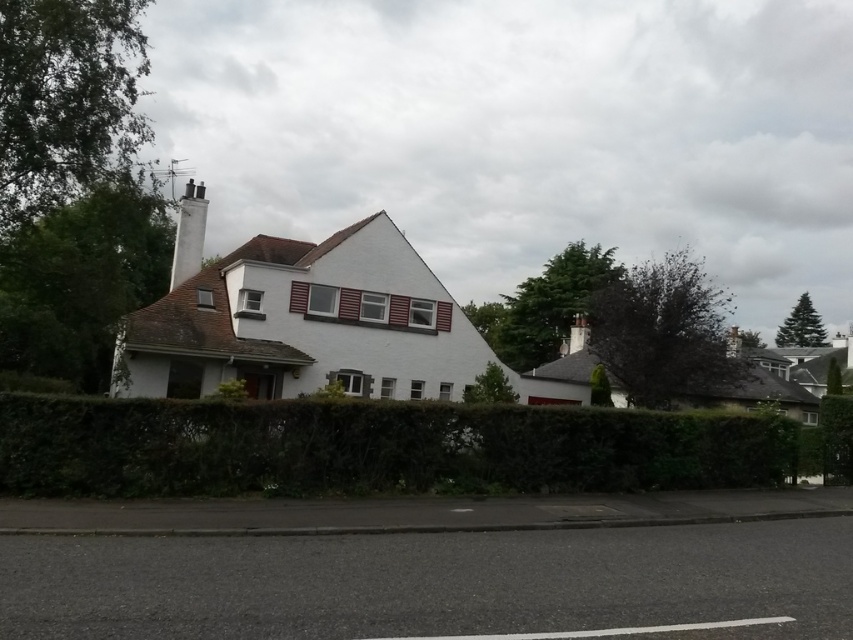
What do you see at coordinates (375, 448) in the screenshot? I see `green leafy hedge at lower center` at bounding box center [375, 448].

Which is above, green leafy hedge at lower center or white smooth chimney at upper center?

white smooth chimney at upper center is higher up.

Does point (376, 404) come behind point (183, 280)?

No, it is not.

Locate an element on the screen. green leafy hedge at lower center is located at coordinates (375, 448).